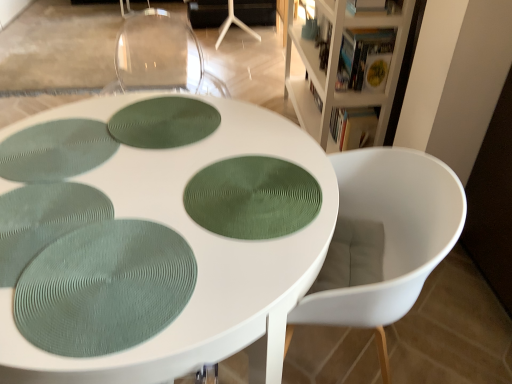
Image resolution: width=512 pixels, height=384 pixels. I want to click on unoccupied space behind green textured placemat at lower left, the first oval from the bottom, so click(141, 189).